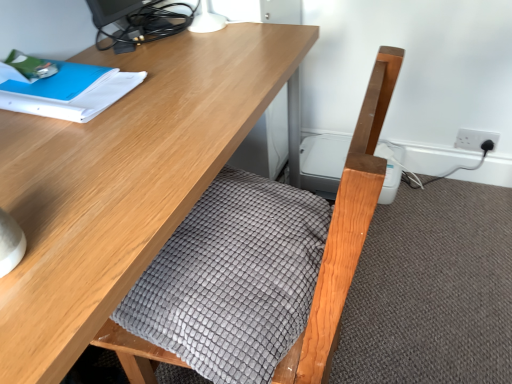
Locate an element on the screen. free space behind blue paper at upper left is located at coordinates (133, 54).